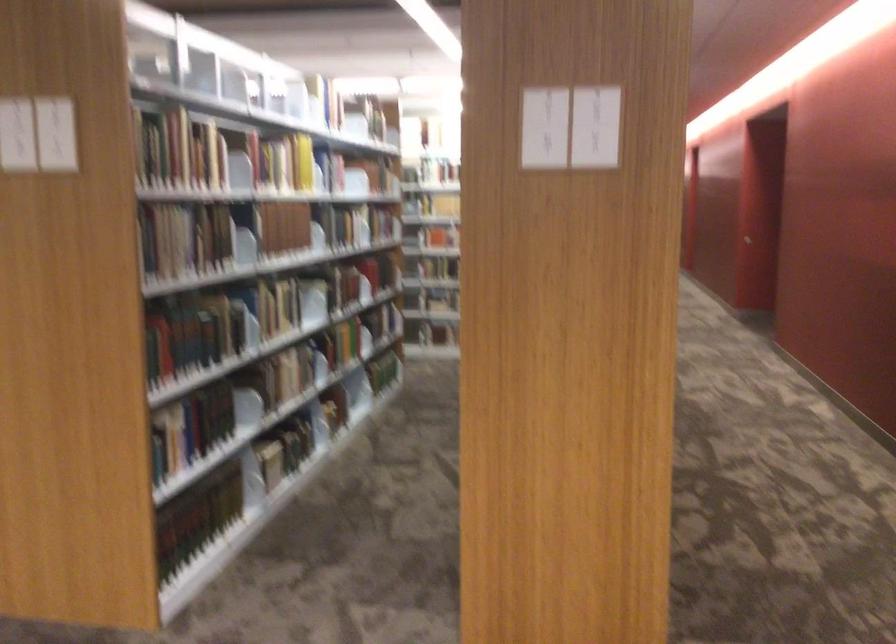
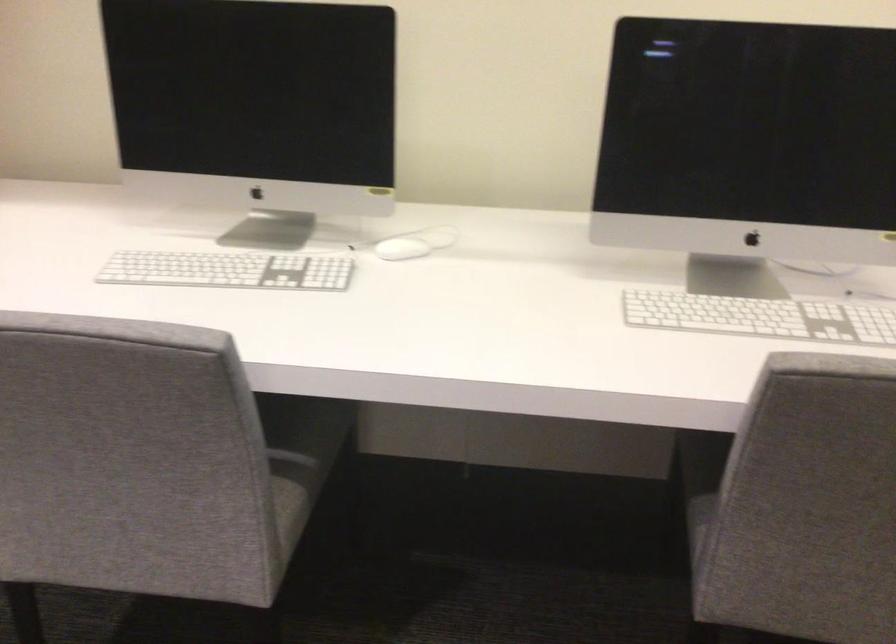
The images are taken continuously from a first-person perspective. In which direction is your viewpoint rotating?

The camera's rotation is toward right-down.